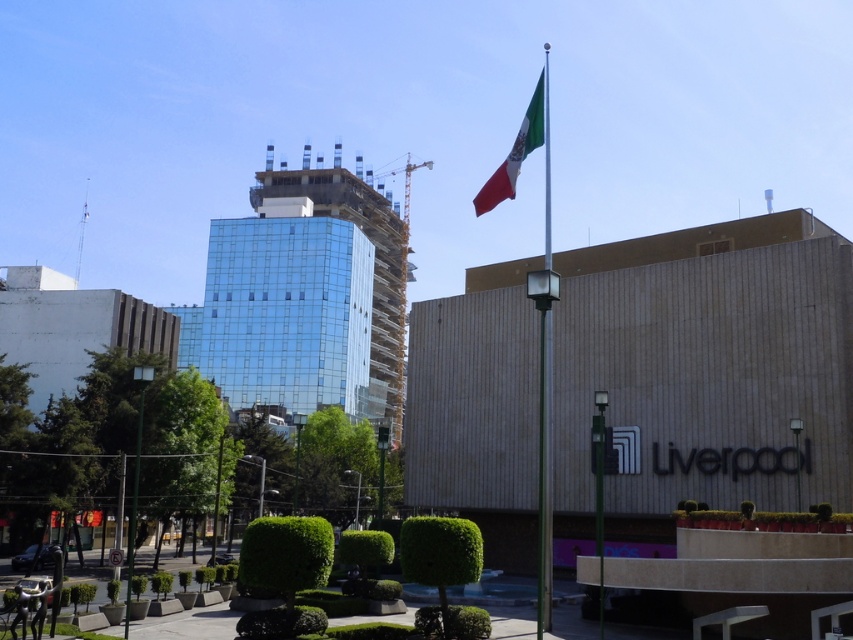
Is transparent glass building at center taller than silver metallic flag pole at center?

In fact, transparent glass building at center may be shorter than silver metallic flag pole at center.

Between transparent glass building at center and silver metallic flag pole at center, which one has less height?

With less height is transparent glass building at center.

Is point (393, 292) less distant than point (544, 627)?

No, (393, 292) is further to viewer.

I want to click on transparent glass building at center, so click(x=305, y=298).

In the scene shown: Does transparent glass building at center have a greater height compared to green and white fabric flag at upper right?

Incorrect, transparent glass building at center's height is not larger of green and white fabric flag at upper right's.

Does point (300, 176) lie behind point (479, 200)?

Yes, point (300, 176) is behind point (479, 200).

The image size is (853, 640). What are the coordinates of `transparent glass building at center` in the screenshot? It's located at (305, 298).

Who is more forward, (544, 612) or (523, 141)?

Point (544, 612) is in front.

Which is behind, point (541, 448) or point (492, 196)?

Point (492, 196)

Between point (544, 388) and point (490, 198), which one is positioned behind?

The point (490, 198) is more distant.

Identify the location of silver metallic flag pole at center. (547, 468).